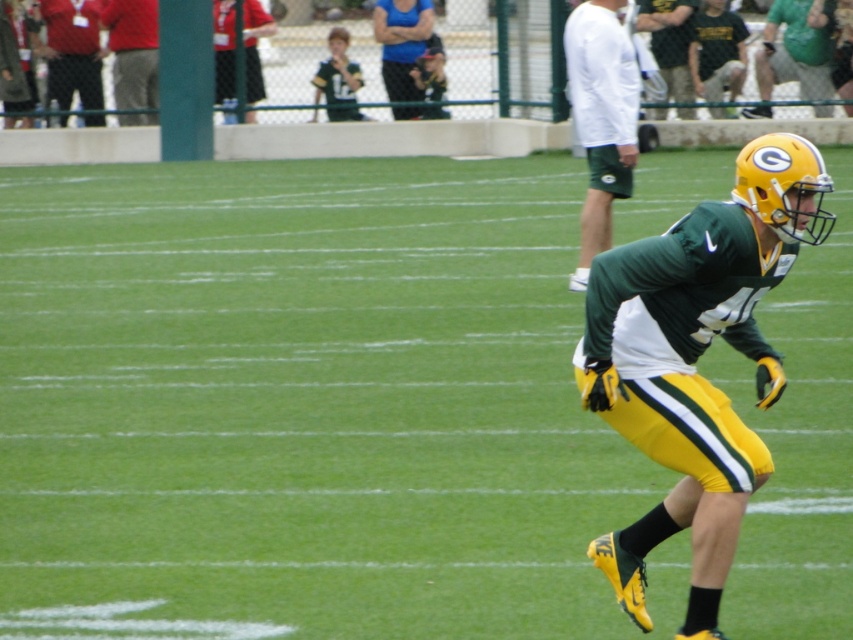
Can you confirm if green matte uniform at right is positioned below matte black pants at left?

Yes.

Which is more to the left, green matte uniform at right or matte black pants at left?

matte black pants at left is more to the left.

Is point (654, 380) positioned before point (61, 36)?

Yes, it is in front of point (61, 36).

Locate an element on the screen. This screenshot has width=853, height=640. green matte uniform at right is located at coordinates [695, 360].

In the scene shown: Is green/yellow uniform at center below dark green jersey at upper right?

Correct, green/yellow uniform at center is located below dark green jersey at upper right.

Between green/yellow uniform at center and dark green jersey at upper right, which one appears on the right side from the viewer's perspective?

From the viewer's perspective, green/yellow uniform at center appears more on the right side.

Who is more distant from viewer, (811, 72) or (708, 28)?

Point (708, 28)

The image size is (853, 640). Identify the location of green/yellow uniform at center. (793, 52).

Does matte black pants at left have a smaller size compared to red shirt at upper left?

No.

Is point (94, 36) positioned before point (234, 1)?

No.

Image resolution: width=853 pixels, height=640 pixels. Identify the location of matte black pants at left. (73, 51).